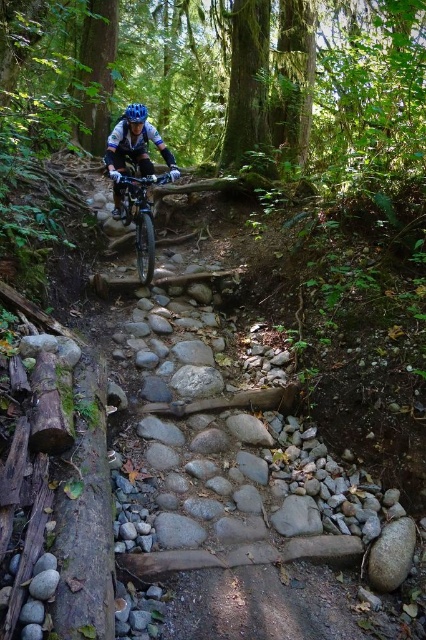
You are a mountain biker trying to navigate the trail. You see two points on the trail marked as point (146, 212) and point (144, 109). Which point should you approach first to stay on the correct path?

You should approach point (144, 109) first because point (146, 212) is behind it, so following the trail correctly requires reaching the first point before the second one.

You are a mountain biker about to start your ride. You see the shiny metallic bicycle at center. Where exactly is the bicycle located in the image?

The shiny metallic bicycle at center is located at point (141, 216) in the image.